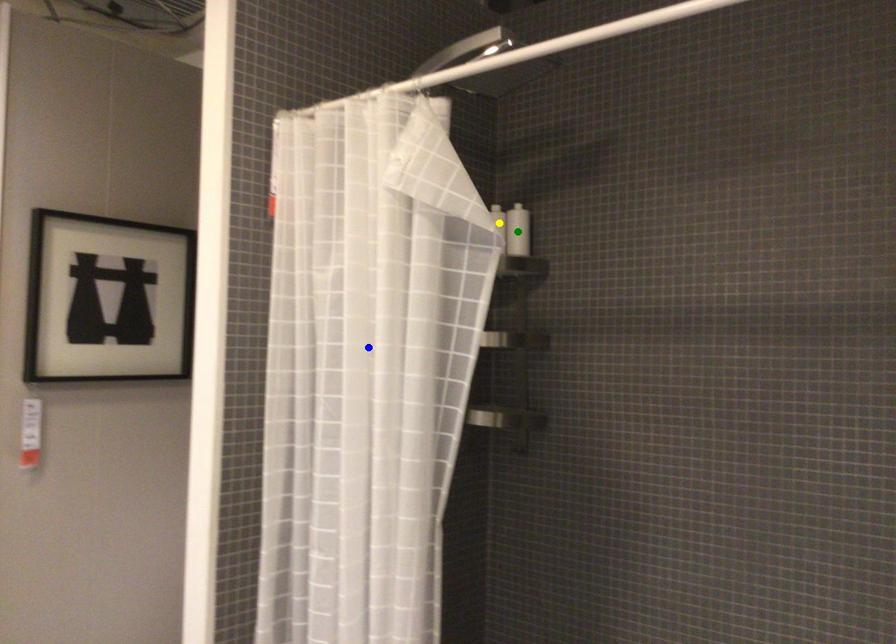
Order these from nearest to farthest:
blue point | green point | yellow point

blue point < green point < yellow point